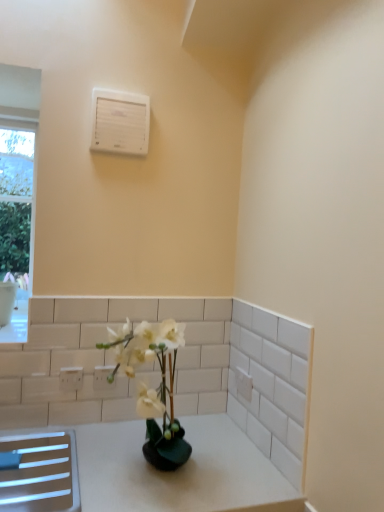
Question: Does white plastic electric outlet at lower left, the second electric outlet in the front-to-back sequence, turn towards white plastic air conditioning unit at upper center?

Choices:
 (A) no
 (B) yes

Answer: (A)

Question: Considering the relative sizes of white plastic electric outlet at lower left, the second electric outlet in the left-to-right sequence, and white plastic air conditioning unit at upper center in the image provided, is white plastic electric outlet at lower left, the second electric outlet in the left-to-right sequence, wider than white plastic air conditioning unit at upper center?

Choices:
 (A) yes
 (B) no

Answer: (B)

Question: From a real-world perspective, is white plastic electric outlet at lower left, the second electric outlet in the front-to-back sequence, physically above white plastic air conditioning unit at upper center?

Choices:
 (A) no
 (B) yes

Answer: (A)

Question: Is white plastic electric outlet at lower left, arranged as the 1th electric outlet when viewed from the right, closer to the viewer compared to white plastic air conditioning unit at upper center?

Choices:
 (A) yes
 (B) no

Answer: (B)

Question: Is the position of white plastic electric outlet at lower left, the second electric outlet in the left-to-right sequence, more distant than that of white plastic air conditioning unit at upper center?

Choices:
 (A) yes
 (B) no

Answer: (A)

Question: Is white plastic air conditioning unit at upper center at the back of white plastic electric outlet at lower left, arranged as the 1th electric outlet when viewed from the right?

Choices:
 (A) no
 (B) yes

Answer: (A)

Question: Considering the relative sizes of white plastic air conditioning unit at upper center and white plastic electric outlet at lower left, the second electric outlet in the front-to-back sequence, in the image provided, is white plastic air conditioning unit at upper center taller than white plastic electric outlet at lower left, the second electric outlet in the front-to-back sequence,?

Choices:
 (A) no
 (B) yes

Answer: (B)

Question: From a real-world perspective, is white plastic air conditioning unit at upper center on top of white plastic electric outlet at lower left, the second electric outlet in the left-to-right sequence?

Choices:
 (A) yes
 (B) no

Answer: (A)

Question: From a real-world perspective, is white plastic air conditioning unit at upper center located beneath white plastic electric outlet at lower left, the second electric outlet in the front-to-back sequence?

Choices:
 (A) yes
 (B) no

Answer: (B)

Question: Is white plastic air conditioning unit at upper center located outside white plastic electric outlet at lower left, arranged as the 1th electric outlet when viewed from the right?

Choices:
 (A) no
 (B) yes

Answer: (B)

Question: Is white plastic air conditioning unit at upper center to the right of white plastic electric outlet at lower left, the second electric outlet in the left-to-right sequence, from the viewer's perspective?

Choices:
 (A) no
 (B) yes

Answer: (B)

Question: Does white plastic air conditioning unit at upper center contain white plastic electric outlet at lower left, which is the 1th electric outlet from back to front?

Choices:
 (A) no
 (B) yes

Answer: (A)

Question: Are white plastic electric outlet at lower left, which is the first electric outlet from front to back, and white plastic air conditioning unit at upper center making contact?

Choices:
 (A) yes
 (B) no

Answer: (B)